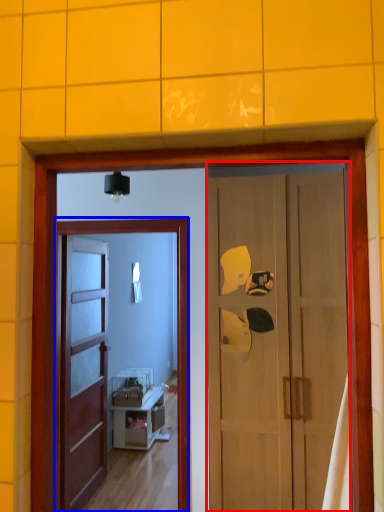
Question: Which of the following is the farthest to the observer, door (highlighted by a red box) or screen door (highlighted by a blue box)?

Choices:
 (A) door
 (B) screen door

Answer: (B)